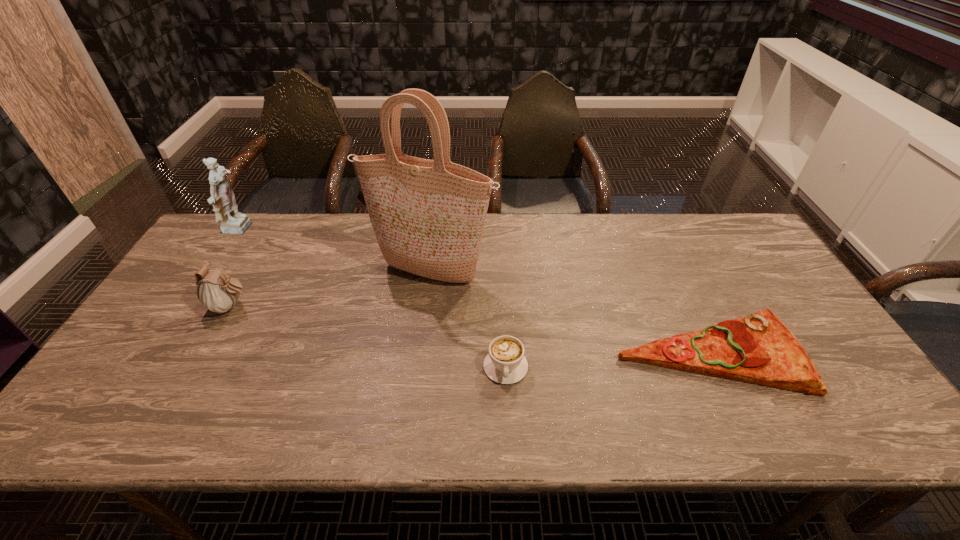
Find the location of a particular element. free space in the image that satisfies the following two spatial constraints: 1. on the front-facing side of the rightmost object; 2. on the right side of the fourth object from right to left is located at coordinates (205, 353).

Identify the location of vacant space that satisfies the following two spatial constraints: 1. on the front-facing side of the rightmost object; 2. on the right side of the fourth object from right to left. (205, 353).

Where is `free space that satisfies the following two spatial constraints: 1. on the front side of the shopping bag; 2. on the front-facing side of the pouch`? free space that satisfies the following two spatial constraints: 1. on the front side of the shopping bag; 2. on the front-facing side of the pouch is located at coordinates (427, 307).

Locate an element on the screen. This screenshot has height=540, width=960. free space that satisfies the following two spatial constraints: 1. on the front-facing side of the figurine; 2. on the left side of the shortest object is located at coordinates (158, 353).